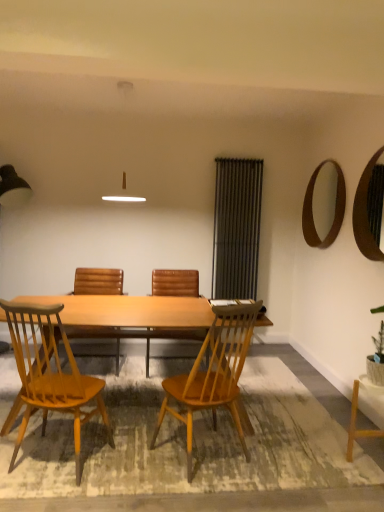
Question: Is metallic silver screen door at right positioned before light wood desk at center?

Choices:
 (A) yes
 (B) no

Answer: (B)

Question: Is metallic silver screen door at right shorter than light wood desk at center?

Choices:
 (A) no
 (B) yes

Answer: (A)

Question: Is metallic silver screen door at right turned away from light wood desk at center?

Choices:
 (A) yes
 (B) no

Answer: (B)

Question: Is metallic silver screen door at right smaller than light wood desk at center?

Choices:
 (A) yes
 (B) no

Answer: (A)

Question: Could you tell me if metallic silver screen door at right is facing light wood desk at center?

Choices:
 (A) no
 (B) yes

Answer: (A)

Question: Is point (193, 290) closer or farther from the camera than point (117, 274)?

Choices:
 (A) farther
 (B) closer

Answer: (B)

Question: Considering their positions, is brown leather chair at center, which is the second chair from back to front, located in front of or behind wooden textured chair at center, the first chair in the back-to-front sequence?

Choices:
 (A) behind
 (B) front

Answer: (B)

Question: Do you think brown leather chair at center, which is the second chair from back to front, is within wooden textured chair at center, the first chair in the back-to-front sequence, or outside of it?

Choices:
 (A) inside
 (B) outside

Answer: (B)

Question: Considering the positions of brown leather chair at center, which is the second chair from back to front, and wooden textured chair at center, the first chair in the back-to-front sequence, in the image, is brown leather chair at center, which is the second chair from back to front, wider or thinner than wooden textured chair at center, the first chair in the back-to-front sequence,?

Choices:
 (A) thin
 (B) wide

Answer: (B)

Question: Considering the positions of wooden textured chair at center, positioned as the 4th chair in front-to-back order, and metallic silver screen door at right in the image, is wooden textured chair at center, positioned as the 4th chair in front-to-back order, bigger or smaller than metallic silver screen door at right?

Choices:
 (A) big
 (B) small

Answer: (A)

Question: Relative to metallic silver screen door at right, is wooden textured chair at center, the first chair in the back-to-front sequence, in front or behind?

Choices:
 (A) behind
 (B) front

Answer: (B)

Question: From a real-world perspective, is wooden textured chair at center, positioned as the 4th chair in front-to-back order, above or below metallic silver screen door at right?

Choices:
 (A) below
 (B) above

Answer: (A)

Question: Based on their positions, is wooden textured chair at center, the first chair in the back-to-front sequence, located to the left or right of metallic silver screen door at right?

Choices:
 (A) right
 (B) left

Answer: (B)

Question: From the image's perspective, is light brown wood chair at center, the first chair when ordered from front to back, located above or below green leafy plant at lower right?

Choices:
 (A) below
 (B) above

Answer: (A)

Question: Is point click(36, 310) positioned closer to the camera than point click(375, 354)?

Choices:
 (A) closer
 (B) farther

Answer: (A)